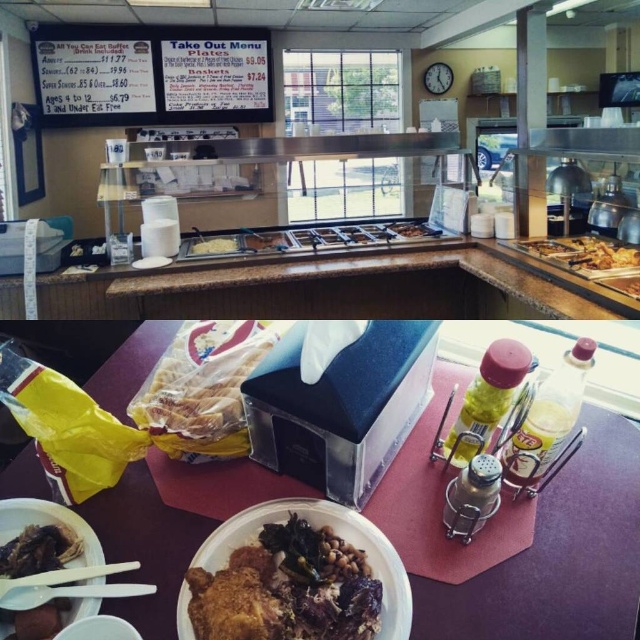
Question: Is the position of white plastic plate at lower left less distant than that of white paper plate at center?

Choices:
 (A) no
 (B) yes

Answer: (B)

Question: Which point appears farthest from the camera in this image?

Choices:
 (A) (216, 252)
 (B) (397, 225)
 (C) (28, 580)
 (D) (22, 513)

Answer: (B)

Question: Does brown granite counter at center lie behind white plastic chopstick at lower left?

Choices:
 (A) no
 (B) yes

Answer: (B)

Question: Which point is closer to the camera?

Choices:
 (A) (266, 525)
 (B) (412, 224)

Answer: (A)

Question: Is brown matte fried chicken at center thinner than white paper plate at center?

Choices:
 (A) no
 (B) yes

Answer: (B)

Question: Which point appears farthest from the camera in this image?

Choices:
 (A) (376, 305)
 (B) (4, 592)
 (C) (257, 589)
 (D) (588, 253)

Answer: (A)